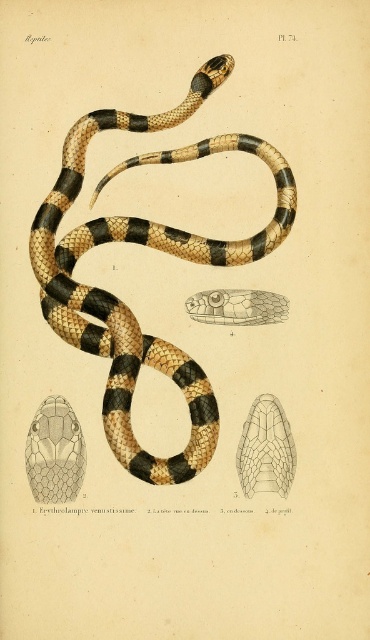
Consider the image. Does matte black snake head at upper center appear on the right side of translucent yellow scales at center?

Incorrect, matte black snake head at upper center is not on the right side of translucent yellow scales at center.

Between matte black snake head at upper center and translucent yellow scales at center, which one has less height?

Standing shorter between the two is translucent yellow scales at center.

Does point (61, 499) come in front of point (264, 481)?

Yes, point (61, 499) is closer to viewer.

At what (x,y) coordinates should I click in order to perform the action: click on matte black snake head at upper center. Please return your answer as a coordinate pair (x, y). This screenshot has height=640, width=370. Looking at the image, I should click on (55, 452).

Based on the photo, does brown and tan scales at center have a greater height compared to translucent yellow scales at center?

Indeed, brown and tan scales at center has a greater height compared to translucent yellow scales at center.

Does brown and tan scales at center appear under translucent yellow scales at center?

Incorrect, brown and tan scales at center is not positioned below translucent yellow scales at center.

Identify the location of brown and tan scales at center. This screenshot has height=640, width=370. (152, 248).

Which is below, brown and tan scales at center or matte black snake head at upper center?

matte black snake head at upper center

Locate an element on the screen. This screenshot has height=640, width=370. brown and tan scales at center is located at coordinates (152, 248).